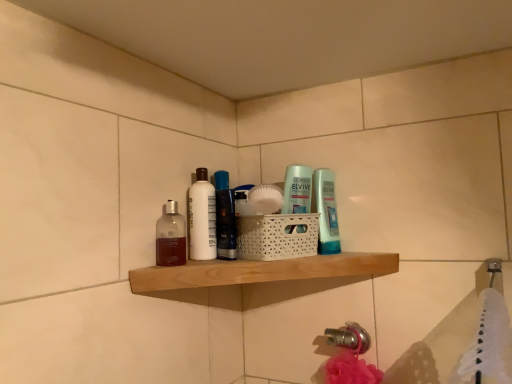
I want to click on free space that is to the left of translucent plastic bottle at center, placed as the 1th toiletry when sorted from right to left, so click(x=269, y=259).